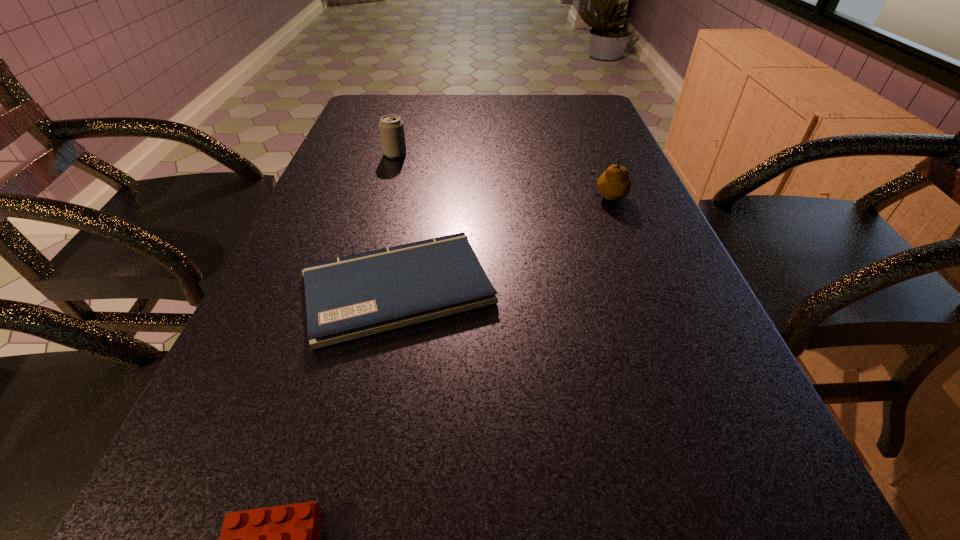
Identify the location of object situated at the right edge. This screenshot has width=960, height=540. [x=614, y=184].

You are a GUI agent. You are given a task and a screenshot of the screen. Output one action in this format:
    pyautogui.click(x=<x>, y=<y>)
    Task: Click on the vacant space at the far edge of the desktop
    
    Given the screenshot: What is the action you would take?
    pyautogui.click(x=453, y=106)

Find the location of a particular element. vacant space at the left edge of the desktop is located at coordinates (293, 247).

This screenshot has height=540, width=960. Find the location of `free space at the right edge`. free space at the right edge is located at coordinates (587, 127).

In order to click on free space at the far left corner in this screenshot , I will do `click(377, 114)`.

I want to click on free space between the rightmost object and the farthest object, so click(502, 174).

Locate an element on the screen. This screenshot has width=960, height=540. vacant area between the pear and the can is located at coordinates (502, 174).

Locate an element on the screen. free spot between the shortest object and the rightmost object is located at coordinates (503, 242).

Locate an element on the screen. vacant point located between the farthest object and the paperback book is located at coordinates (396, 221).

Identify the location of free spot between the shortest object and the can. The height and width of the screenshot is (540, 960). (396, 221).